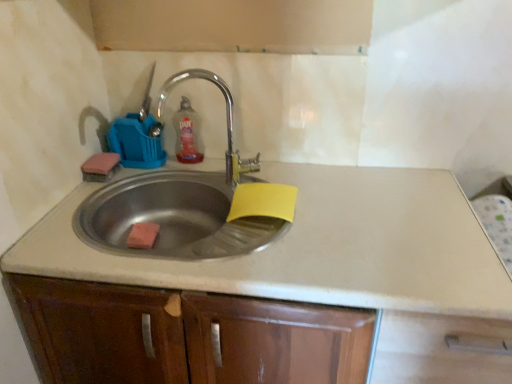
Where is `beige laminate countertop at center`? This screenshot has width=512, height=384. beige laminate countertop at center is located at coordinates (319, 247).

This screenshot has width=512, height=384. What do you see at coordinates (188, 204) in the screenshot?
I see `stainless steel sink at center` at bounding box center [188, 204].

The height and width of the screenshot is (384, 512). What do you see at coordinates (143, 235) in the screenshot?
I see `orange sponge at sink` at bounding box center [143, 235].

Locate an element on the screen. The width and height of the screenshot is (512, 384). orange sponge at sink is located at coordinates (143, 235).

Locate an element on the screen. The image size is (512, 384). beige laminate countertop at center is located at coordinates (319, 247).

Between point (212, 175) and point (142, 234), which one is positioned behind?

The point (212, 175) is farther.

From a real-world perspective, which object rests below the other?

From a 3D spatial view, orange sponge at sink is below.

Looking at this image, is stainless steel sink at center to the right of orange sponge at sink from the viewer's perspective?

Yes.

The width and height of the screenshot is (512, 384). I want to click on soap dispenser behind the stainless steel sink at center, so click(187, 134).

Measure the distance between translucent plastic bottle at upper center and stainless steel sink at center.

translucent plastic bottle at upper center is 25.44 centimeters from stainless steel sink at center.

Looking at this image, which is more distant, (196, 119) or (195, 256)?

The point (196, 119) is behind.

Is translucent plastic bottle at upper center facing towards stainless steel sink at center?

Yes.

How many degrees apart are the facing directions of orange sponge at sink and stainless steel sink at center?

4.74 degrees separate the facing orientations of orange sponge at sink and stainless steel sink at center.

From the image's perspective, who appears lower, orange sponge at sink or stainless steel sink at center?

orange sponge at sink is shown below in the image.

Is orange sponge at sink bigger or smaller than stainless steel sink at center?

In the image, orange sponge at sink appears to be smaller than stainless steel sink at center.

Consider the image. Between orange sponge at sink and stainless steel sink at center, which one has larger width?

stainless steel sink at center is wider.

Is beige laminate countertop at center located outside orange sponge at sink?

beige laminate countertop at center lies outside orange sponge at sink's area.

From the image's perspective, would you say beige laminate countertop at center is shown under orange sponge at sink?

Indeed, from the image's perspective, beige laminate countertop at center is shown beneath orange sponge at sink.

Considering the sizes of objects beige laminate countertop at center and orange sponge at sink in the image provided, who is thinner, beige laminate countertop at center or orange sponge at sink?

orange sponge at sink.

Which object is closer to the camera taking this photo, beige laminate countertop at center or orange sponge at sink?

beige laminate countertop at center is closer to the camera.

Locate an element on the screen. This screenshot has height=384, width=512. soap dispenser above the beige laminate countertop at center (from the image's perspective) is located at coordinates (187, 134).

Could you tell me if translucent plastic bottle at upper center is facing beige laminate countertop at center?

No, translucent plastic bottle at upper center is not turned towards beige laminate countertop at center.

Does point (198, 153) appear closer or farther from the camera than point (505, 300)?

Point (198, 153).

Is translucent plastic bottle at upper center shorter than beige laminate countertop at center?

Correct, translucent plastic bottle at upper center is not as tall as beige laminate countertop at center.

Which object is further away from the camera taking this photo, stainless steel sink at center or translucent plastic bottle at upper center?

translucent plastic bottle at upper center is further away from the camera.

Would you say stainless steel sink at center is a long distance from translucent plastic bottle at upper center?

No, stainless steel sink at center is not far away from translucent plastic bottle at upper center.

Which is more to the left, stainless steel sink at center or translucent plastic bottle at upper center?

From the viewer's perspective, translucent plastic bottle at upper center appears more on the left side.

Who is smaller, stainless steel sink at center or translucent plastic bottle at upper center?

translucent plastic bottle at upper center is smaller.

From the image's perspective, is beige laminate countertop at center located above or below translucent plastic bottle at upper center?

beige laminate countertop at center is situated lower than translucent plastic bottle at upper center in the image.

Can you tell me how much beige laminate countertop at center and translucent plastic bottle at upper center differ in facing direction?

1.82 degrees separate the facing orientations of beige laminate countertop at center and translucent plastic bottle at upper center.

Which object is thinner, beige laminate countertop at center or translucent plastic bottle at upper center?

With smaller width is translucent plastic bottle at upper center.

Based on the photo, considering the relative sizes of beige laminate countertop at center and translucent plastic bottle at upper center in the image provided, is beige laminate countertop at center taller than translucent plastic bottle at upper center?

Yes.

Find the location of a particular element. soap located below the stainless steel sink at center (from the image's perspective) is located at coordinates (143, 235).

Locate an element on the screen. Image resolution: width=512 pixels, height=384 pixels. soap dispenser above the stainless steel sink at center (from a real-world perspective) is located at coordinates (187, 134).

Based on their spatial positions, is translucent plastic bottle at upper center or orange sponge at sink closer to beige laminate countertop at center?

orange sponge at sink is closer to beige laminate countertop at center.

Considering their positions, is translucent plastic bottle at upper center positioned closer to beige laminate countertop at center than stainless steel sink at center?

Among the two, stainless steel sink at center is located nearer to beige laminate countertop at center.

Looking at this image, from the image, which object appears to be farther from orange sponge at sink, translucent plastic bottle at upper center or stainless steel sink at center?

translucent plastic bottle at upper center.

Based on their spatial positions, is beige laminate countertop at center or translucent plastic bottle at upper center further from orange sponge at sink?

beige laminate countertop at center.

Consider the image. Which object lies further to the anchor point orange sponge at sink, translucent plastic bottle at upper center or beige laminate countertop at center?

beige laminate countertop at center is further to orange sponge at sink.

Which object lies nearer to the anchor point stainless steel sink at center, orange sponge at sink or beige laminate countertop at center?

The object closer to stainless steel sink at center is beige laminate countertop at center.

Based on their spatial positions, is beige laminate countertop at center or orange sponge at sink further from translucent plastic bottle at upper center?

beige laminate countertop at center.

From the image, which object appears to be nearer to stainless steel sink at center, beige laminate countertop at center or translucent plastic bottle at upper center?

beige laminate countertop at center lies closer to stainless steel sink at center than the other object.

Where is `sink between translucent plastic bottle at upper center and beige laminate countertop at center from top to bottom`? The height and width of the screenshot is (384, 512). sink between translucent plastic bottle at upper center and beige laminate countertop at center from top to bottom is located at coordinates (188, 204).

Identify the location of soap between translucent plastic bottle at upper center and beige laminate countertop at center in the up-down direction. (143, 235).

At what (x,y) coordinates should I click in order to perform the action: click on sink positioned between beige laminate countertop at center and orange sponge at sink from near to far. Please return your answer as a coordinate pair (x, y). This screenshot has height=384, width=512. Looking at the image, I should click on (188, 204).

Find the location of a particular element. soap positioned between stainless steel sink at center and translucent plastic bottle at upper center from near to far is located at coordinates (143, 235).